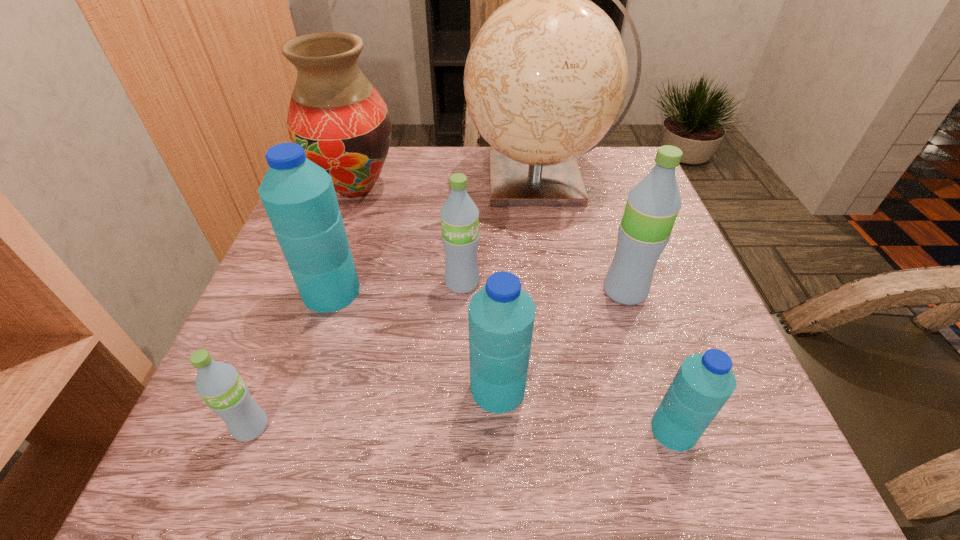
Where is `free space that satisfies the following two spatial constraints: 1. on the surface of the globe showing Europe and Africa; 2. on the back side of the biggest green water bottle`? This screenshot has height=540, width=960. free space that satisfies the following two spatial constraints: 1. on the surface of the globe showing Europe and Africa; 2. on the back side of the biggest green water bottle is located at coordinates (560, 291).